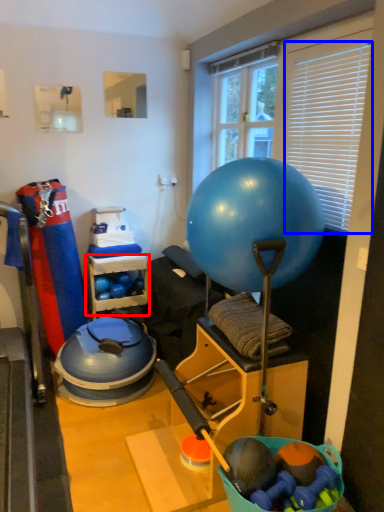
Question: Which point is closer to the camera, shelf (highlighted by a red box) or blind (highlighted by a blue box)?

Choices:
 (A) shelf
 (B) blind

Answer: (B)